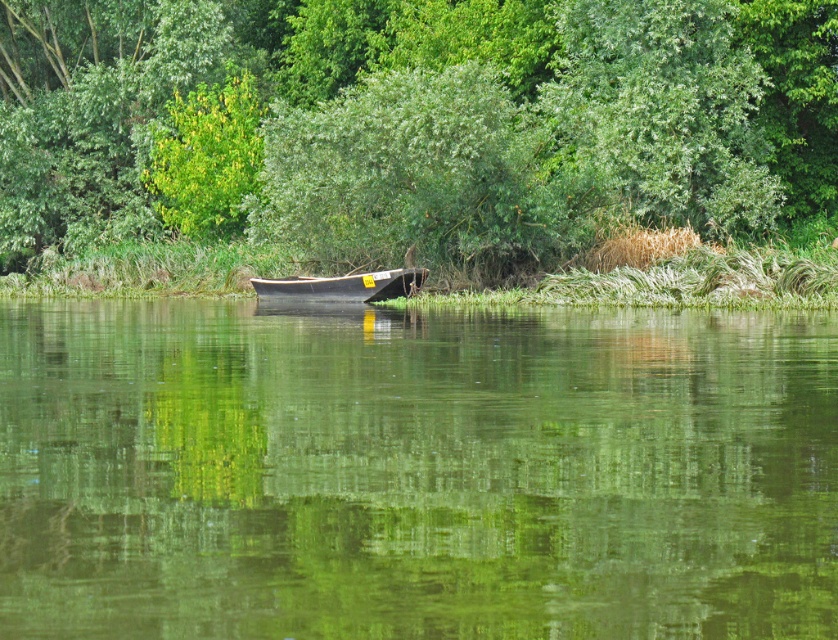
You are planning to take a photo of the green smooth water at center and the green leafy tree at center in the riverside scene. Which object takes up more space in the image?

The green leafy tree at center takes up more space in the image than the green smooth water at center because the green smooth water at center occupies less space than green leafy tree at center.

From the picture: You are standing at the riverside and want to take a photo of the wooden boat at center. However, there is a green leafy tree at center in your view. Will the tree block your view of the boat?

The green leafy tree at center is in front of the wooden boat at center, so it will block your view of the boat.

You are standing on the riverside and see the green smooth water at center and the wooden boat at center. Which object is closer to the ground?

The green smooth water at center is below the wooden boat at center, so the green smooth water at center is closer to the ground.